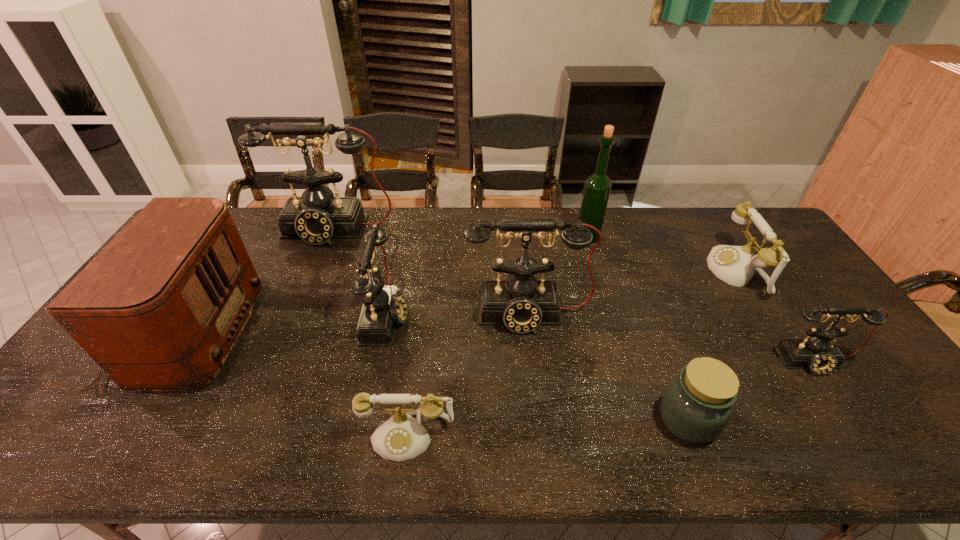
Find the location of a particular element. The height and width of the screenshot is (540, 960). liquor is located at coordinates (597, 187).

Image resolution: width=960 pixels, height=540 pixels. What are the coordinates of `the farthest black telephone` in the screenshot? It's located at (317, 217).

This screenshot has width=960, height=540. I want to click on the tallest telephone, so click(317, 217).

The image size is (960, 540). Find the location of `the third smallest black telephone`. the third smallest black telephone is located at coordinates (521, 303).

Where is `the third telephone from right to left`? the third telephone from right to left is located at coordinates (521, 303).

Where is `radio receiver`? The width and height of the screenshot is (960, 540). radio receiver is located at coordinates (161, 306).

You are a GUI agent. You are given a task and a screenshot of the screen. Output one action in this format:
    pyautogui.click(x=<x>, y=<y>)
    Task: Click on the third tallest telephone
    The image size is (960, 540).
    Given the screenshot: What is the action you would take?
    click(x=383, y=307)

I want to click on the third biggest black telephone, so click(383, 307).

The width and height of the screenshot is (960, 540). In order to click on the smallest black telephone in this screenshot , I will do click(818, 352).

Identify the location of the bigger white telephone. The width and height of the screenshot is (960, 540). (735, 265).